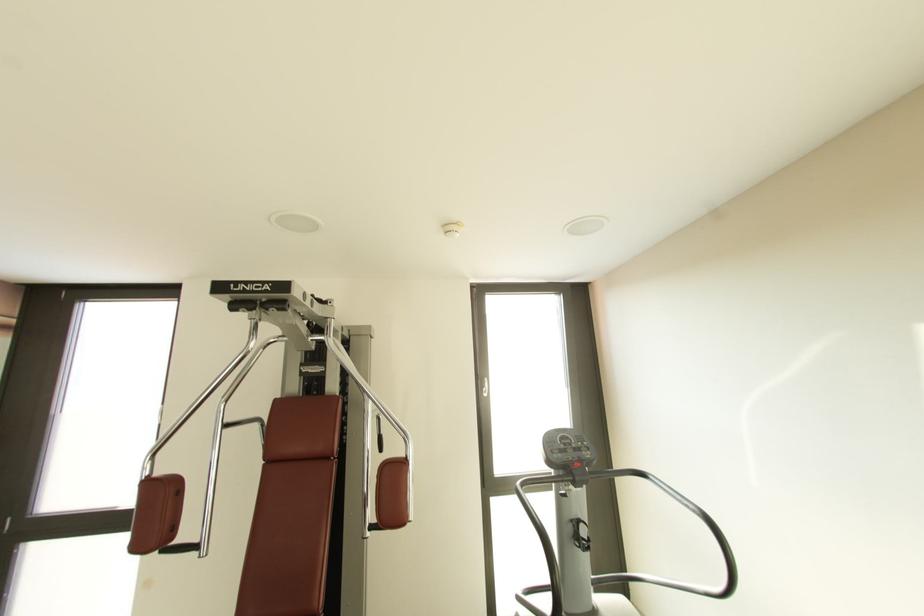
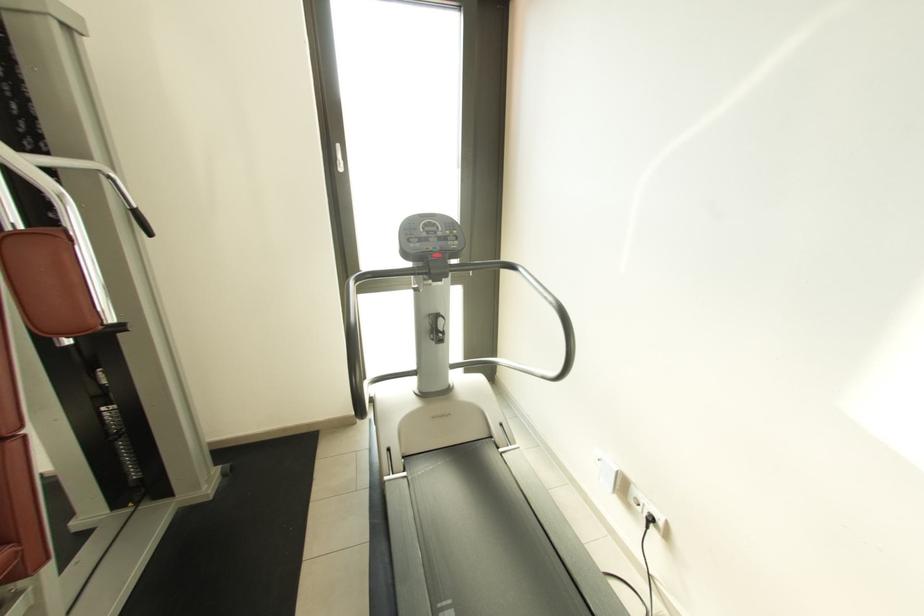
Question: The images are taken continuously from a first-person perspective. In which direction is your viewpoint rotating?

Choices:
 (A) Left
 (B) Right
 (C) Up
 (D) Down

Answer: (D)